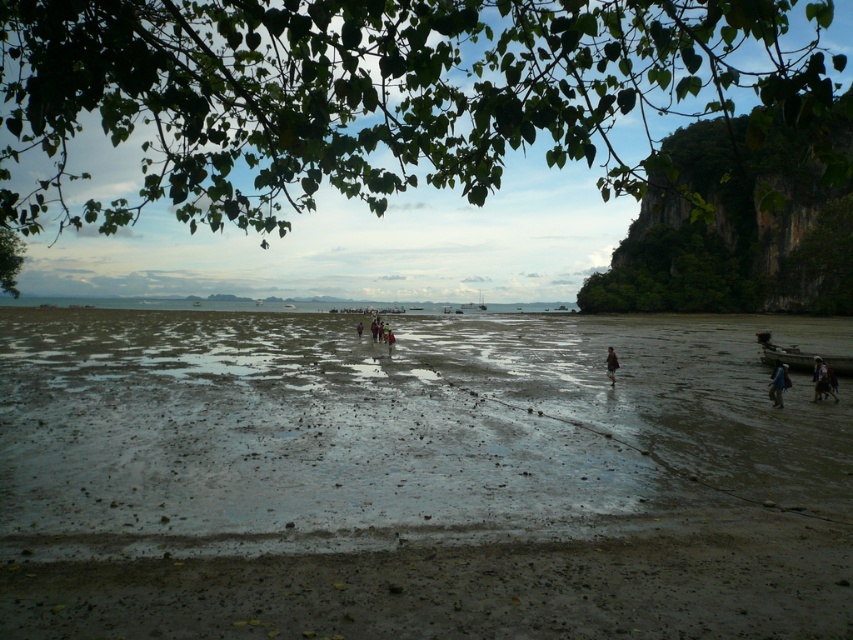
Question: Where is muddy sand at center located in relation to dark blue jeans at center in the image?

Choices:
 (A) left
 (B) right

Answer: (A)

Question: Is the position of blue fabric bag at lower right more distant than that of dark blue jeans at center?

Choices:
 (A) no
 (B) yes

Answer: (A)

Question: Which point is closer to the camera?

Choices:
 (A) (195, 593)
 (B) (821, 362)
 (C) (611, 368)
 (D) (775, 390)

Answer: (A)

Question: Which point is closer to the camera?

Choices:
 (A) blue fabric bag at lower right
 (B) dark blue fabric person at lower right

Answer: (A)

Question: Which object is farther from the camera taking this photo?

Choices:
 (A) muddy sand at center
 (B) brown fabric person at lower right

Answer: (B)

Question: Does brown fabric person at lower right have a smaller size compared to dark blue jeans at center?

Choices:
 (A) no
 (B) yes

Answer: (B)